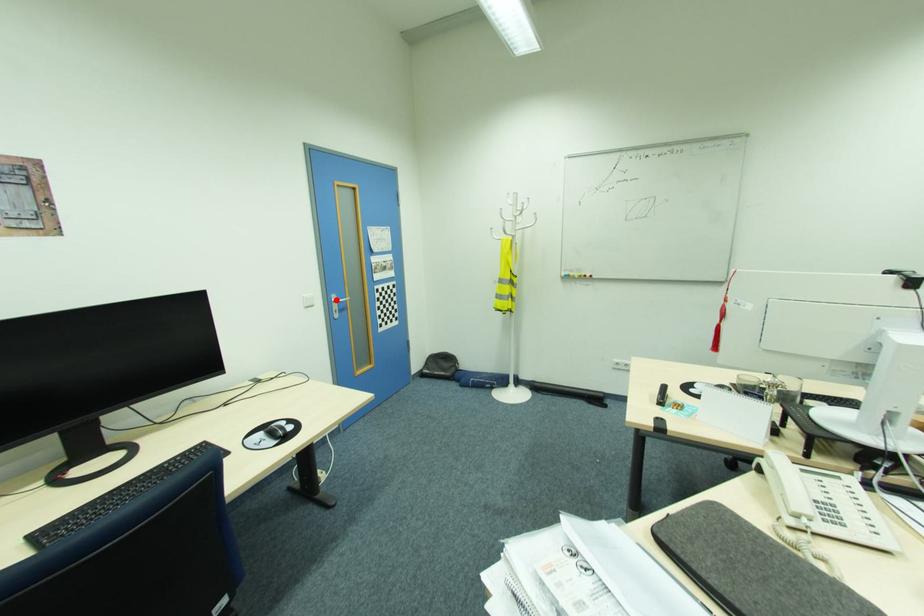
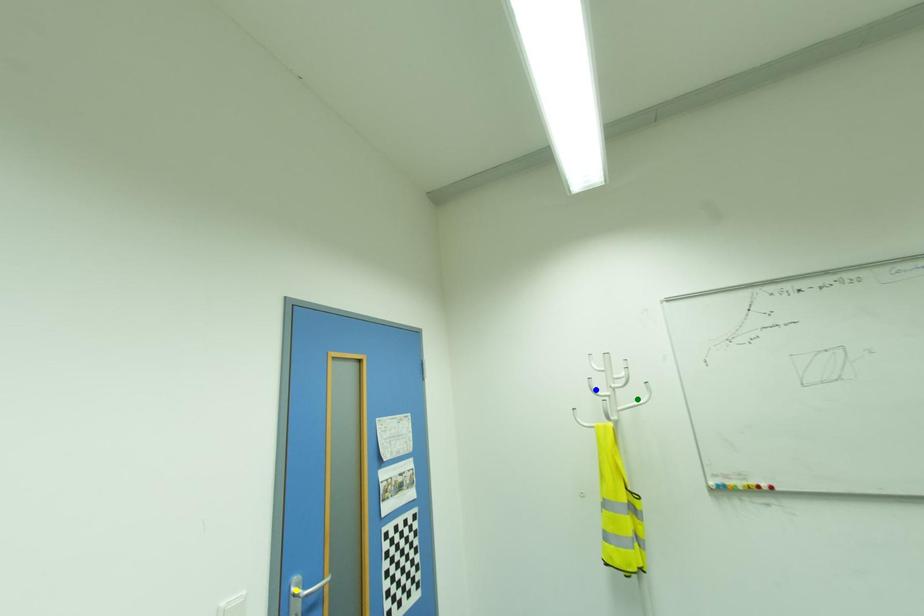
Question: I am providing you with two images of the same scene from different viewpoints. A red point is marked on the first image. You are given multiple points on the second image. Which point in image 2 represents the same 3d spot as the red point in image 1?

Choices:
 (A) blue point
 (B) yellow point
 (C) green point

Answer: (B)